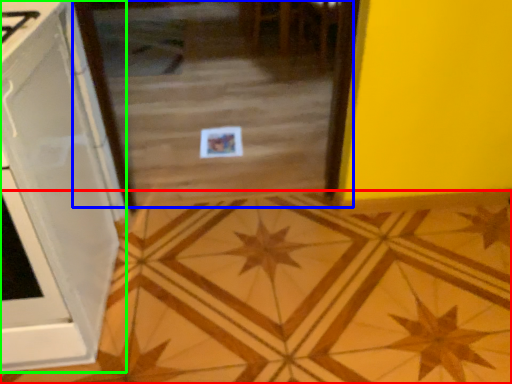
Question: Considering the real-world distances, which object is closest to ceramic tile (highlighted by a red box)? glass door (highlighted by a blue box) or cabinetry (highlighted by a green box).

Choices:
 (A) glass door
 (B) cabinetry

Answer: (B)